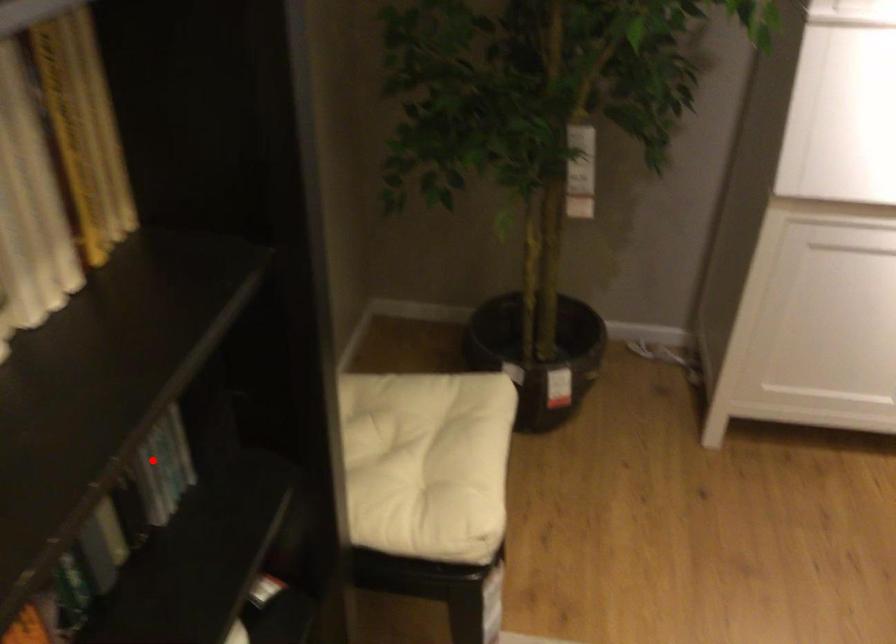
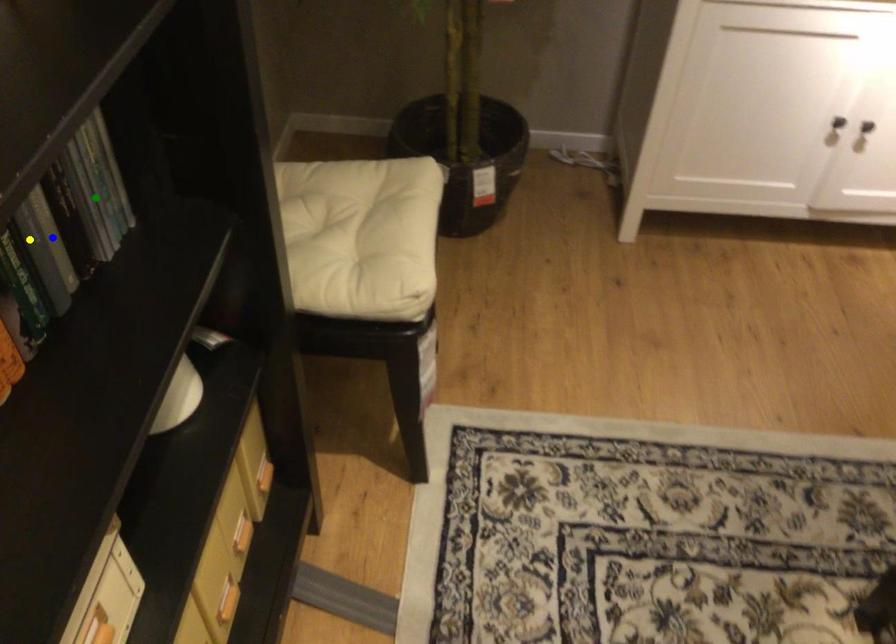
Question: I am providing you with two images of the same scene from different viewpoints. A red point is marked on the first image. You are given multiple points on the second image. Which point in image 2 is actually the same real-world point as the red point in image 1?

Choices:
 (A) yellow point
 (B) blue point
 (C) green point

Answer: (C)